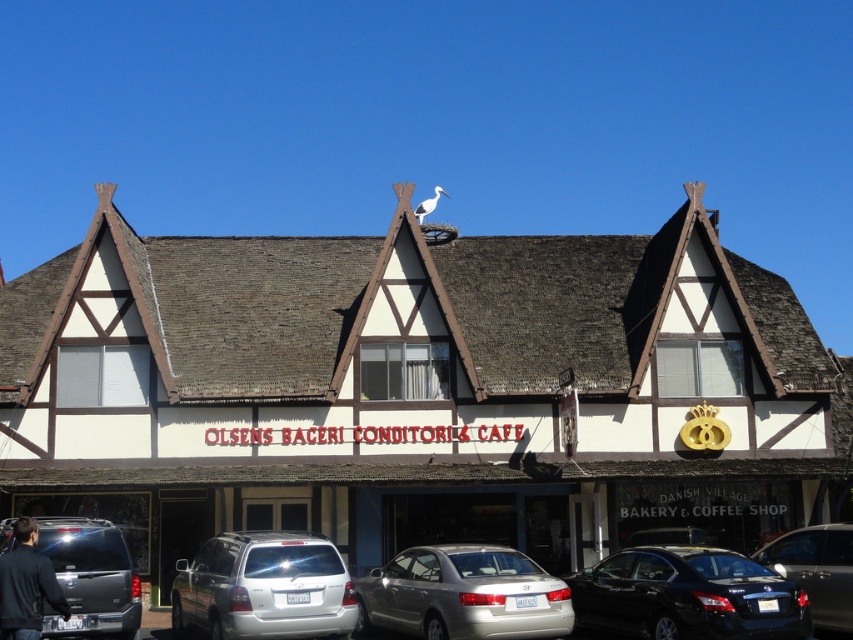
Question: Does metallic gray suv at lower left have a smaller size compared to metallic silver sedan at lower right?

Choices:
 (A) no
 (B) yes

Answer: (A)

Question: Is shiny black sedan at lower right further to the viewer compared to metallic silver sedan at lower right?

Choices:
 (A) no
 (B) yes

Answer: (A)

Question: Among these points, which one is farthest from the camera?

Choices:
 (A) (561, 609)
 (B) (360, 355)

Answer: (B)

Question: Does shiny black sedan at lower right have a greater width compared to metallic silver sedan at lower center?

Choices:
 (A) no
 (B) yes

Answer: (A)

Question: Among these objects, which one is farthest from the camera?

Choices:
 (A) metallic silver sedan at lower right
 (B) metallic gray suv at lower left

Answer: (A)

Question: Which of the following is the closest to the observer?

Choices:
 (A) metallic silver sedan at lower right
 (B) metallic silver sedan at lower center
 (C) silver metallic station wagon at lower left

Answer: (C)